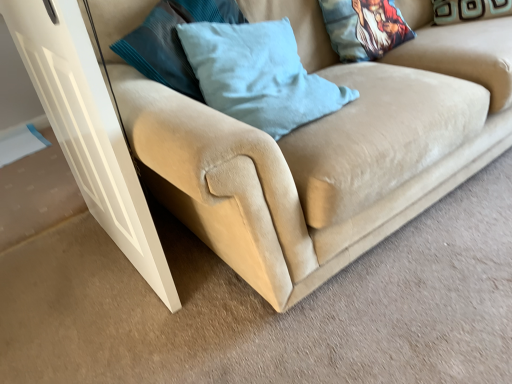
This screenshot has height=384, width=512. In order to click on vacant region to the left of white glossy door at lower left in this screenshot , I will do `click(60, 274)`.